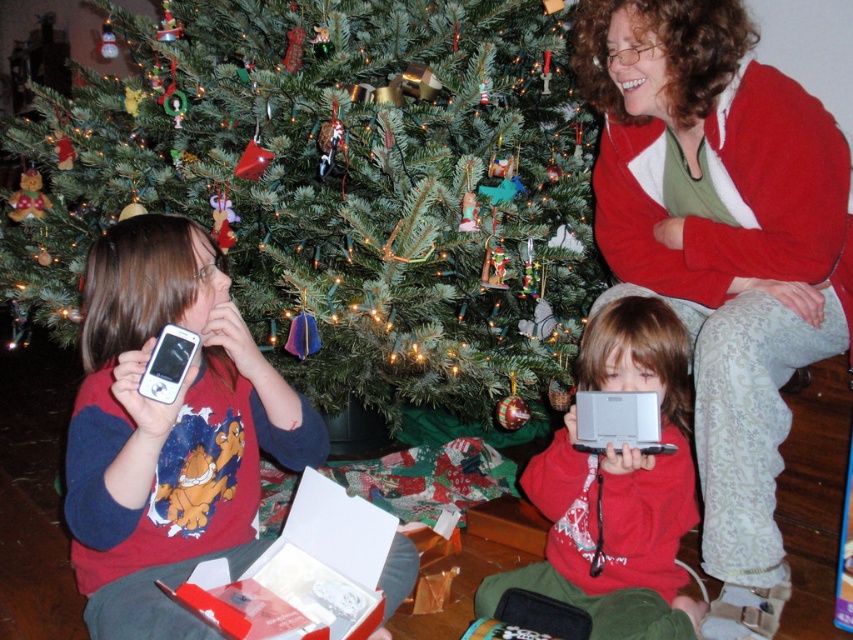
Question: Estimate the real-world distances between objects in this image. Which object is farther from the silver metallic handheld device at center?

Choices:
 (A) green matte christmas tree at center
 (B) red sweater at center

Answer: (A)

Question: Among these objects, which one is farthest from the camera?

Choices:
 (A) silver metallic handheld device at center
 (B) red sweater at center
 (C) green matte christmas tree at center

Answer: (C)

Question: Which of these objects is positioned farthest from the silver metallic handheld device at center?

Choices:
 (A) red sweater at center
 (B) green matte christmas tree at center

Answer: (B)

Question: Considering the relative positions of green matte christmas tree at center and red sweater at center in the image provided, where is green matte christmas tree at center located with respect to red sweater at center?

Choices:
 (A) above
 (B) below

Answer: (A)

Question: Does red sweater at center have a larger size compared to silver metallic handheld device at center?

Choices:
 (A) no
 (B) yes

Answer: (B)

Question: Is green matte christmas tree at center positioned at the back of silver metallic handheld device at center?

Choices:
 (A) yes
 (B) no

Answer: (A)